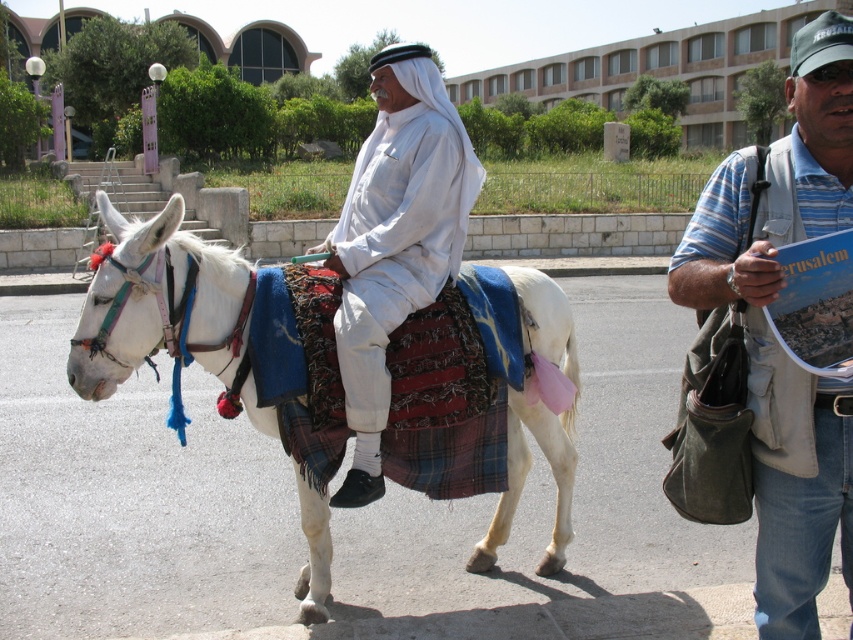
Does striped cotton shirt at right have a lesser height compared to white plaid saddle at center?

No, striped cotton shirt at right is not shorter than white plaid saddle at center.

Is striped cotton shirt at right further to the viewer compared to white plaid saddle at center?

No, it is not.

Where is `striped cotton shirt at right`? striped cotton shirt at right is located at coordinates (772, 333).

Is striped cotton shirt at right below white cotton shirt at center?

Incorrect, striped cotton shirt at right is not positioned below white cotton shirt at center.

The image size is (853, 640). What are the coordinates of `striped cotton shirt at right` in the screenshot? It's located at (772, 333).

Does white cotton shirt at center have a lesser width compared to white plaid saddle at center?

No.

Can you confirm if white cotton shirt at center is positioned above white plaid saddle at center?

Indeed, white cotton shirt at center is positioned over white plaid saddle at center.

Which is in front, point (366, 209) or point (300, 486)?

Point (366, 209) is in front.

Image resolution: width=853 pixels, height=640 pixels. In order to click on white cotton shirt at center in this screenshot , I will do `click(395, 240)`.